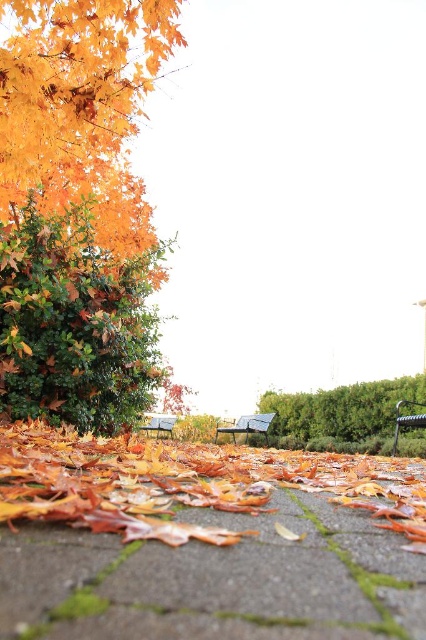
Can you confirm if golden textured leaves at left is positioned to the right of metallic blue bench at center?

Incorrect, golden textured leaves at left is not on the right side of metallic blue bench at center.

Does golden textured leaves at left come behind metallic blue bench at center?

No, golden textured leaves at left is in front of metallic blue bench at center.

Locate an element on the screen. golden textured leaves at left is located at coordinates (77, 209).

Locate an element on the screen. The image size is (426, 640). golden textured leaves at left is located at coordinates (77, 209).

Looking at this image, between orange leaf litter at lower center and wooden park bench at center, which one is positioned lower?

wooden park bench at center

Is orange leaf litter at lower center to the left of wooden park bench at center from the viewer's perspective?

Yes, orange leaf litter at lower center is to the left of wooden park bench at center.

Image resolution: width=426 pixels, height=640 pixels. What do you see at coordinates (187, 483) in the screenshot? I see `orange leaf litter at lower center` at bounding box center [187, 483].

Find the location of a particular element. orange leaf litter at lower center is located at coordinates (187, 483).

Who is positioned more to the left, metallic blue bench at center or wooden park bench at center?

Positioned to the left is metallic blue bench at center.

Does metallic blue bench at center have a lesser height compared to wooden park bench at center?

Correct, metallic blue bench at center is not as tall as wooden park bench at center.

What do you see at coordinates (247, 426) in the screenshot?
I see `metallic blue bench at center` at bounding box center [247, 426].

I want to click on metallic blue bench at center, so click(247, 426).